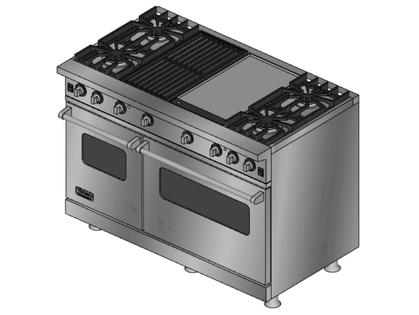
Image resolution: width=419 pixels, height=315 pixels. Find the location of `glass window on right`. glass window on right is located at coordinates (195, 200).